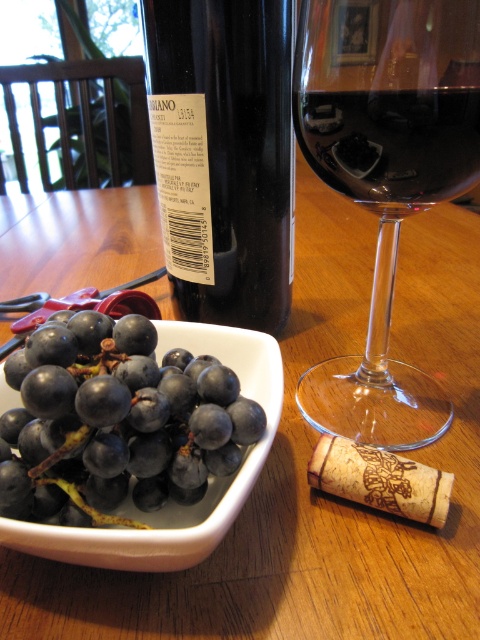
Question: Can you confirm if transparent glass wine glass at center is thinner than black glass bottle at center?

Choices:
 (A) yes
 (B) no

Answer: (A)

Question: Which object appears farthest from the camera in this image?

Choices:
 (A) shiny dark purple grapes at lower left
 (B) wooden table at center

Answer: (B)

Question: Considering the relative positions of wooden table at center and black glass bottle at center in the image provided, where is wooden table at center located with respect to black glass bottle at center?

Choices:
 (A) right
 (B) left

Answer: (A)

Question: Which of the following is the farthest from the observer?

Choices:
 (A) (118, 419)
 (B) (111, 618)
 (C) (250, 250)

Answer: (C)

Question: Among these objects, which one is nearest to the camera?

Choices:
 (A) black glass bottle at center
 (B) transparent glass wine glass at center
 (C) shiny dark purple grapes at lower left
 (D) dark red liquid at center

Answer: (C)

Question: Observing the image, what is the correct spatial positioning of transparent glass wine glass at center in reference to shiny dark purple grapes at lower left?

Choices:
 (A) above
 (B) below

Answer: (A)